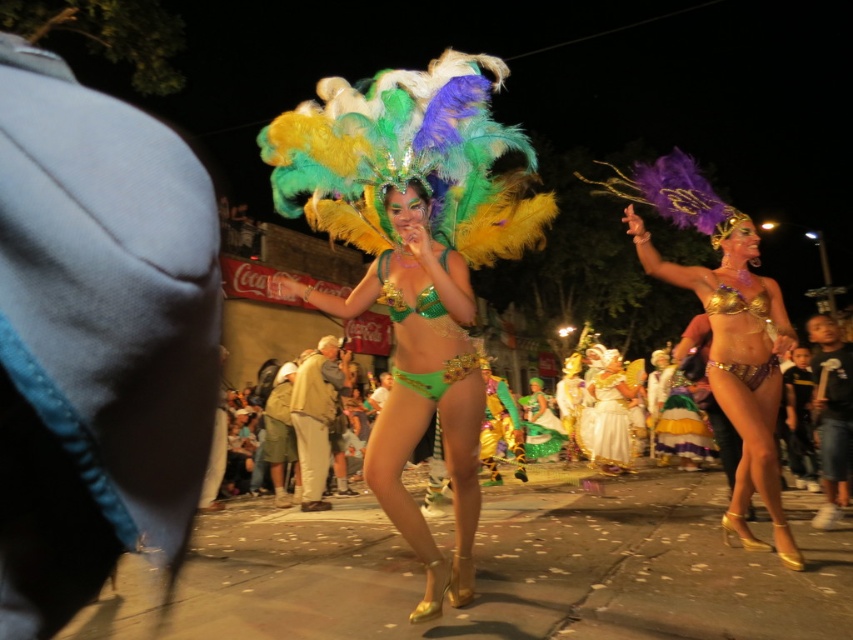
Question: Estimate the real-world distances between objects in this image. Which object is farther from the gold metallic bikini at center?

Choices:
 (A) green metallic bikini at center
 (B) multicolored sequined skirt at center

Answer: (B)

Question: Which point is closer to the camera?

Choices:
 (A) multicolored sequined skirt at center
 (B) green metallic bikini at center
 (C) shiny green bikini at center

Answer: (B)

Question: Which point is farther from the camera taking this photo?

Choices:
 (A) (621, 400)
 (B) (552, 428)
 (C) (426, 385)

Answer: (B)

Question: Is green sequined bikini at center in front of multicolored sequined skirt at center?

Choices:
 (A) yes
 (B) no

Answer: (A)

Question: In this image, where is gold metallic bikini at center located relative to green sequined bikini at center?

Choices:
 (A) left
 (B) right

Answer: (B)

Question: Is multicolored sequined skirt at center thinner than shiny green bikini at center?

Choices:
 (A) no
 (B) yes

Answer: (A)